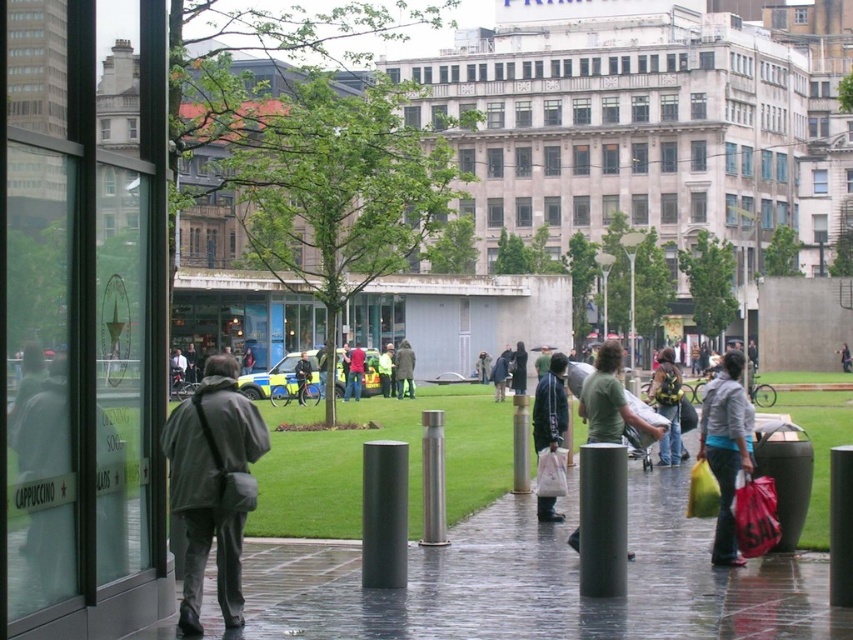
Question: Does satin silver pole at center have a greater width compared to green fabric backpack at center?

Choices:
 (A) no
 (B) yes

Answer: (A)

Question: Which of the following is the closest to the observer?

Choices:
 (A) (722, 458)
 (B) (646, 420)

Answer: (A)

Question: Which point appears closest to the camera in this image?

Choices:
 (A) (546, 372)
 (B) (438, 532)
 (C) (729, 369)
 (D) (604, 403)

Answer: (B)

Question: Can you confirm if green fabric coat at center is positioned to the left of red fabric jacket at center?

Choices:
 (A) yes
 (B) no

Answer: (B)

Question: Which object appears closest to the camera in this image?

Choices:
 (A) yellow reflective jacket at center
 (B) red fabric jacket at center
 (C) satin silver pole at center
 (D) green uniform at center

Answer: (C)

Question: Does matte black jacket at center appear over red fabric jacket at center?

Choices:
 (A) yes
 (B) no

Answer: (B)